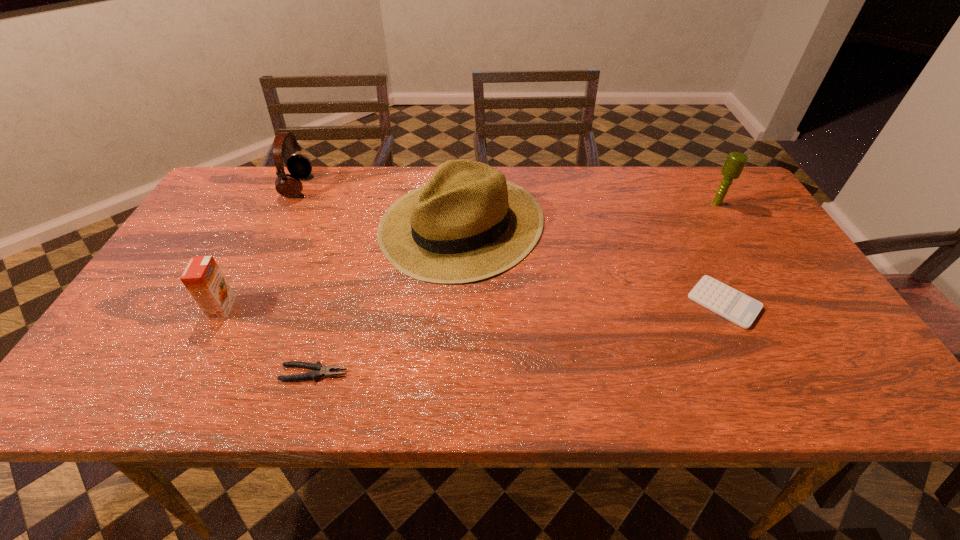
You are a GUI agent. You are given a task and a screenshot of the screen. Output one action in this format:
    pyautogui.click(x=<x>, y=<y>)
    Task: Click on the vacant space in between the pliers and the rightmost object
    
    Given the screenshot: What is the action you would take?
    pyautogui.click(x=516, y=288)

In order to click on empty space that is in between the second shortest object and the third shortest object in this screenshot , I will do (268, 341).

Find the location of a particular element. This screenshot has height=540, width=960. free spot between the second shortest object and the fourth tallest object is located at coordinates pos(268,341).

At what (x,y) coordinates should I click in order to perform the action: click on vacant region between the headset and the sunhat. Please return your answer as a coordinate pair (x, y). The height and width of the screenshot is (540, 960). Looking at the image, I should click on (380, 205).

Choose which object is the third nearest neighbor to the fifth object from left to right. Please provide its 2D coordinates. Your answer should be formatted as a tuple, i.e. [(x, y)], where the tuple contains the x and y coordinates of a point satisfying the conditions above.

[(318, 370)]

Locate an element on the screen. the closest object to the headset is located at coordinates (468, 223).

Locate an element on the screen. free spot that satisfies the following two spatial constraints: 1. on the ear pads of the headset; 2. on the back side of the sunhat is located at coordinates (279, 224).

Find the location of a particular element. The image size is (960, 540). vacant space that satisfies the following two spatial constraints: 1. on the ear pads of the shortest object; 2. on the left side of the headset is located at coordinates point(240,302).

Where is `vacant space that satisfies the following two spatial constraints: 1. on the ear pads of the headset; 2. on the left side of the sunhat`? The height and width of the screenshot is (540, 960). vacant space that satisfies the following two spatial constraints: 1. on the ear pads of the headset; 2. on the left side of the sunhat is located at coordinates (279, 224).

Locate an element on the screen. free location that satisfies the following two spatial constraints: 1. on the ear pads of the microphone; 2. on the left side of the headset is located at coordinates (289, 204).